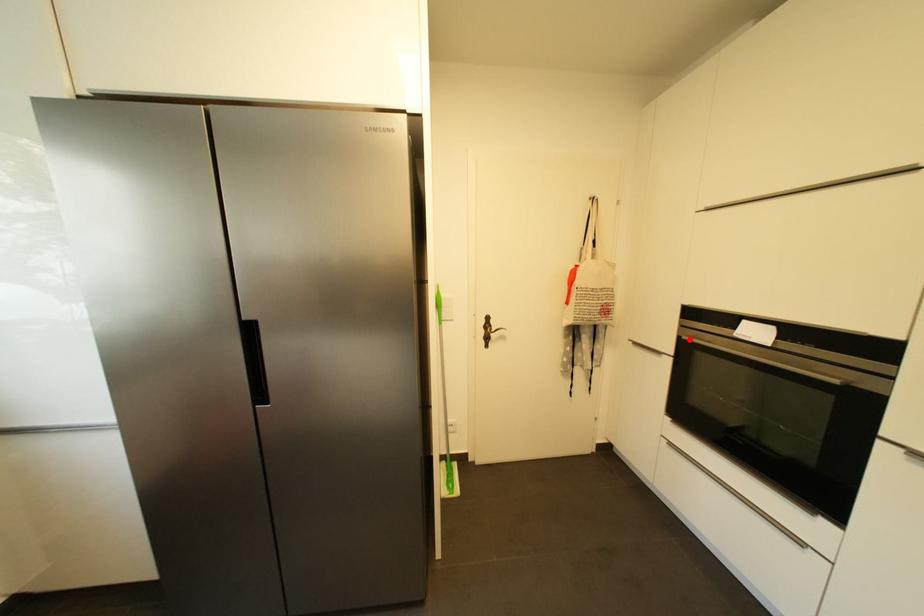
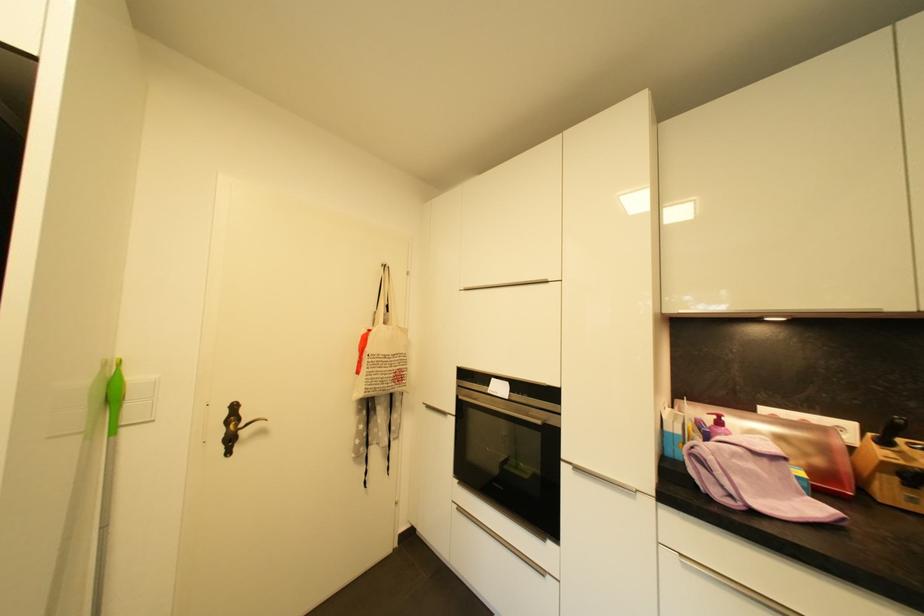
In the second image, find the point that corresponds to the highlighted location in the first image.

(466, 399)